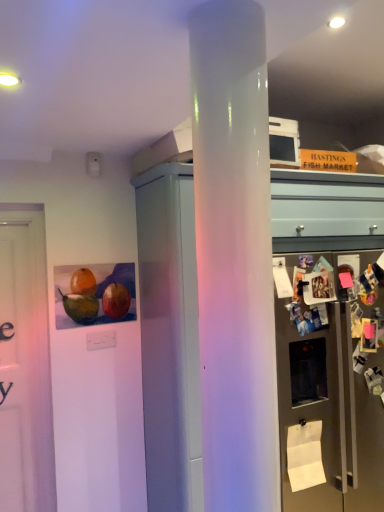
What do you see at coordinates (329, 386) in the screenshot?
I see `satin silver refrigerator at right` at bounding box center [329, 386].

What do you see at coordinates (305, 455) in the screenshot?
I see `white paper at lower right` at bounding box center [305, 455].

Where is `satin silver refrigerator at right`? The width and height of the screenshot is (384, 512). satin silver refrigerator at right is located at coordinates (329, 386).

Does satin silver refrigerator at right have a lesser height compared to white glossy cabinet at center?

Correct, satin silver refrigerator at right is not as tall as white glossy cabinet at center.

What's the angular difference between satin silver refrigerator at right and white glossy cabinet at center's facing directions?

0.000752 degrees.

Is white glossy cabinet at center inside satin silver refrigerator at right?

Actually, white glossy cabinet at center is outside satin silver refrigerator at right.

Is satin silver refrigerator at right at the left side of white glossy cabinet at center?

No.

Is satin silver refrigerator at right smaller than white paper at lower right?

Incorrect, satin silver refrigerator at right is not smaller in size than white paper at lower right.

Between satin silver refrigerator at right and white paper at lower right, which one has less height?

With less height is white paper at lower right.

The image size is (384, 512). I want to click on refrigerator lying in front of the white paper at lower right, so click(329, 386).

How different are the orientations of satin silver refrigerator at right and white paper at lower right in degrees?

The facing directions of satin silver refrigerator at right and white paper at lower right are 0.00367 degrees apart.

Locate an element on the screen. toilet paper behind the white glossy cabinet at center is located at coordinates (305, 455).

From a real-world perspective, is white paper at lower right beneath white glossy cabinet at center?

Yes, from a real-world perspective, white paper at lower right is below white glossy cabinet at center.

Is white paper at lower right in contact with white glossy cabinet at center?

No, white paper at lower right is not next to white glossy cabinet at center.

Measure the distance from white paper at lower right to white glossy cabinet at center.

white paper at lower right is 14.01 inches from white glossy cabinet at center.

Between white glossy cabinet at center and white paper at lower right, which one is positioned behind?

Positioned behind is white paper at lower right.

Does white glossy cabinet at center appear on the left side of white paper at lower right?

Indeed, white glossy cabinet at center is positioned on the left side of white paper at lower right.

Which is correct: white glossy cabinet at center is inside white paper at lower right, or outside of it?

white glossy cabinet at center is located beyond the bounds of white paper at lower right.

Consider the image. From the image's perspective, is white glossy cabinet at center above or below white paper at lower right?

From the image's perspective, white glossy cabinet at center appears above white paper at lower right.

Considering the positions of objects white paper at lower right and satin silver refrigerator at right in the image provided, who is more to the left, white paper at lower right or satin silver refrigerator at right?

white paper at lower right.

Which of these two, white paper at lower right or satin silver refrigerator at right, stands taller?

Standing taller between the two is satin silver refrigerator at right.

Considering the sizes of objects white paper at lower right and satin silver refrigerator at right in the image provided, who is smaller, white paper at lower right or satin silver refrigerator at right?

Smaller between the two is white paper at lower right.

From the image's perspective, is white paper at lower right above or below satin silver refrigerator at right?

white paper at lower right is below satin silver refrigerator at right.

Which of these two, white glossy cabinet at center or satin silver refrigerator at right, stands shorter?

With less height is satin silver refrigerator at right.

Is white glossy cabinet at center wider or thinner than satin silver refrigerator at right?

Considering their sizes, white glossy cabinet at center looks broader than satin silver refrigerator at right.

From the image's perspective, would you say white glossy cabinet at center is positioned over satin silver refrigerator at right?

Actually, white glossy cabinet at center appears below satin silver refrigerator at right in the image.

Is white glossy cabinet at center looking in the opposite direction of satin silver refrigerator at right?

No, white glossy cabinet at center is not facing away from satin silver refrigerator at right.

Where is `refrigerator above the white glossy cabinet at center (from the image's perspective)`? Image resolution: width=384 pixels, height=512 pixels. refrigerator above the white glossy cabinet at center (from the image's perspective) is located at coordinates (329, 386).

The height and width of the screenshot is (512, 384). Find the location of `toilet paper that is under the satin silver refrigerator at right (from a real-world perspective)`. toilet paper that is under the satin silver refrigerator at right (from a real-world perspective) is located at coordinates (305, 455).

Based on the photo, which object lies further to the anchor point white paper at lower right, white glossy cabinet at center or satin silver refrigerator at right?

Among the two, white glossy cabinet at center is located further to white paper at lower right.

Based on their spatial positions, is satin silver refrigerator at right or white paper at lower right closer to white glossy cabinet at center?

satin silver refrigerator at right.

Looking at the image, which one is located closer to white paper at lower right, satin silver refrigerator at right or white glossy cabinet at center?

The object closer to white paper at lower right is satin silver refrigerator at right.

When comparing their distances from satin silver refrigerator at right, does white paper at lower right or white glossy cabinet at center seem further?

white paper at lower right is further to satin silver refrigerator at right.

When comparing their distances from white glossy cabinet at center, does white paper at lower right or satin silver refrigerator at right seem closer?

satin silver refrigerator at right.

When comparing their distances from satin silver refrigerator at right, does white glossy cabinet at center or white paper at lower right seem closer?

Among the two, white glossy cabinet at center is located nearer to satin silver refrigerator at right.

Identify the location of toilet paper located between white glossy cabinet at center and satin silver refrigerator at right in the left-right direction. The width and height of the screenshot is (384, 512). (305, 455).